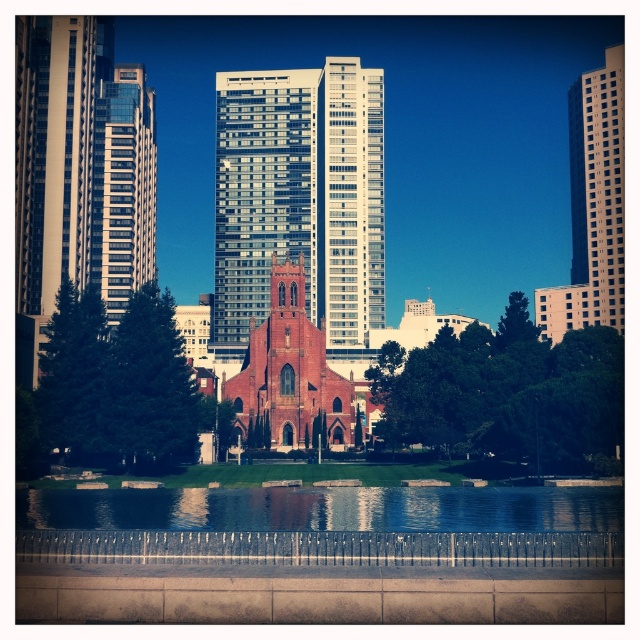
Where is `clear water at lower center`? The image size is (640, 640). clear water at lower center is located at coordinates (324, 508).

Between point (163, 524) and point (563, 300), which one is positioned in front?

Point (163, 524)

Is point (502, 488) farther from viewer compared to point (609, 52)?

No, it is not.

Identify the location of clear water at lower center. (324, 508).

Between clear water at lower center and glassy reflective skyscraper at left, which one is positioned lower?

clear water at lower center is below.

Which is in front, point (445, 525) or point (92, 269)?

Point (445, 525)

Locate an element on the screen. clear water at lower center is located at coordinates (324, 508).

Locate an element on the screen. clear water at lower center is located at coordinates (324, 508).

Can you confirm if white glass skyscraper at center is positioned below clear water at lower center?

No.

Does point (236, 208) lie behind point (620, 529)?

Yes.

The image size is (640, 640). I want to click on white glass skyscraper at center, so coord(300,195).